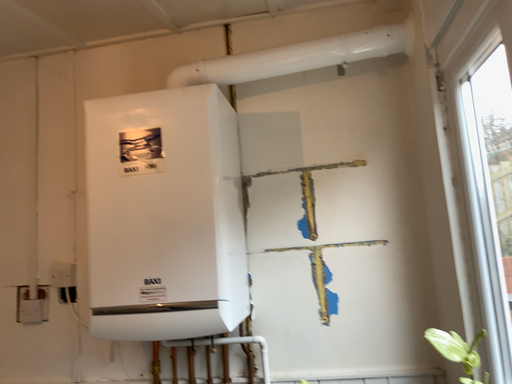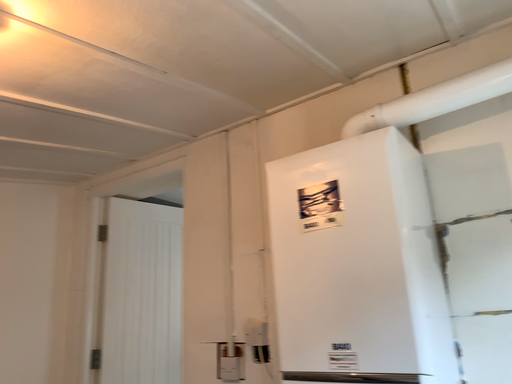
Question: Which way did the camera rotate in the video?

Choices:
 (A) rotated right
 (B) rotated left

Answer: (B)